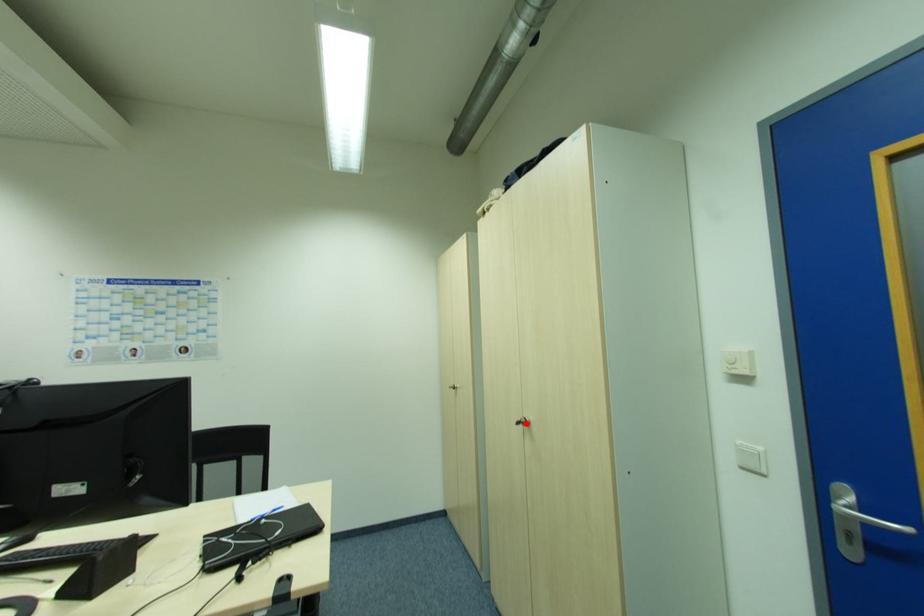
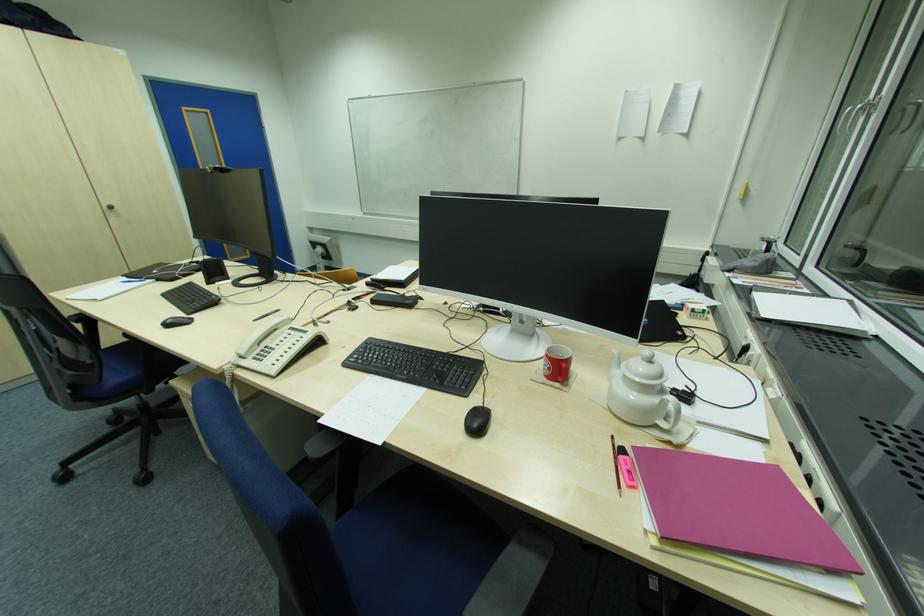
In the second image, find the point that corresponds to the highlighted location in the first image.

(114, 209)